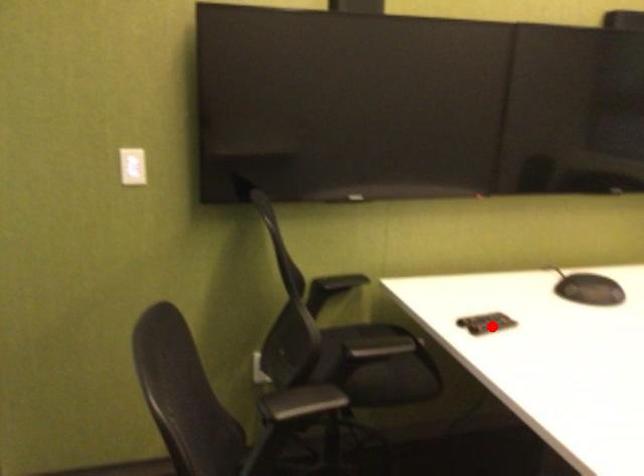
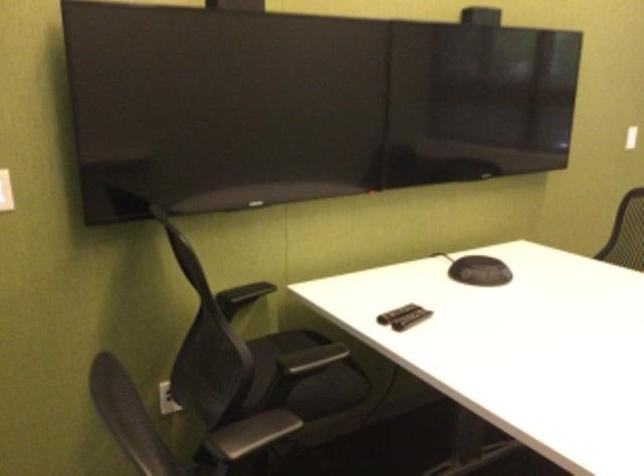
In the second image, find the point that corresponds to the highlighted location in the first image.

(411, 319)